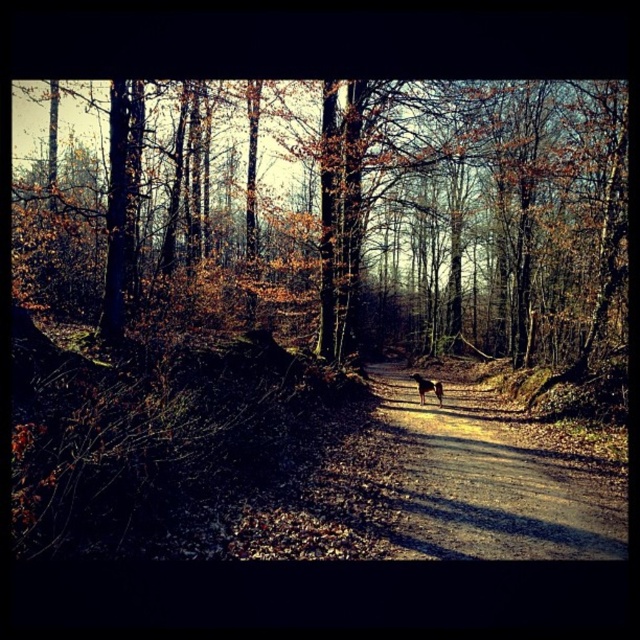
Question: Can you confirm if brown dirt path at center is positioned above brown fur dog at center?

Choices:
 (A) no
 (B) yes

Answer: (A)

Question: Is brown bark tree at center to the left of brown fur dog at center from the viewer's perspective?

Choices:
 (A) yes
 (B) no

Answer: (A)

Question: Which object is closer to the camera taking this photo?

Choices:
 (A) brown bark tree at center
 (B) brown fur dog at center

Answer: (A)

Question: Among these points, which one is nearest to the camera?

Choices:
 (A) (412, 435)
 (B) (420, 401)
 (C) (488, 307)

Answer: (A)

Question: Does brown bark tree at center appear over brown fur dog at center?

Choices:
 (A) no
 (B) yes

Answer: (B)

Question: Which point is farther to the camera?

Choices:
 (A) (515, 547)
 (B) (413, 378)

Answer: (B)